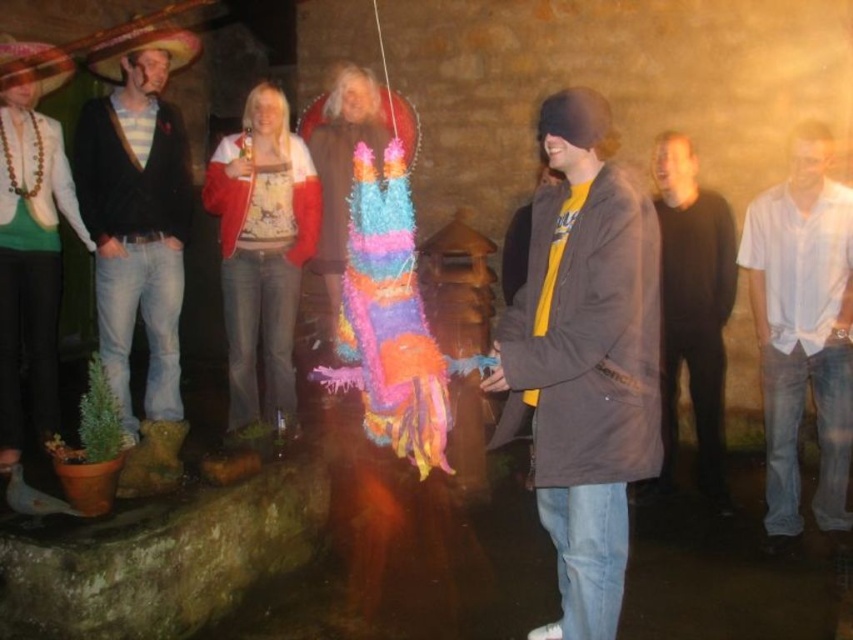
Question: Based on their relative distances, which object is farther from the white cotton shirt at right?

Choices:
 (A) striped shirt at left
 (B) matte brown sombrero at upper left
 (C) black matte jacket at center
 (D) gray suede jacket at center

Answer: (B)

Question: From the image, what is the correct spatial relationship of black matte jacket at center in relation to matte brown sombrero at upper left?

Choices:
 (A) left
 (B) right

Answer: (B)

Question: Does white cotton shirt at right have a greater width compared to matte brown sombrero at upper left?

Choices:
 (A) no
 (B) yes

Answer: (A)

Question: Among these objects, which one is farthest from the camera?

Choices:
 (A) striped shirt at left
 (B) white cotton shirt at right
 (C) matte brown sombrero at upper left

Answer: (C)

Question: Considering the relative positions of gray suede jacket at center and red felt sombrero at upper left in the image provided, where is gray suede jacket at center located with respect to red felt sombrero at upper left?

Choices:
 (A) above
 (B) below

Answer: (B)

Question: Which point is closer to the camera?

Choices:
 (A) (683, 356)
 (B) (828, 433)

Answer: (B)